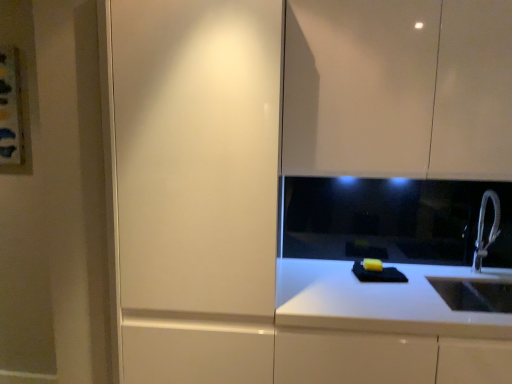
Find the location of a particular element. This screenshot has height=384, width=512. free space to the left of white metallic faucet at right is located at coordinates (441, 276).